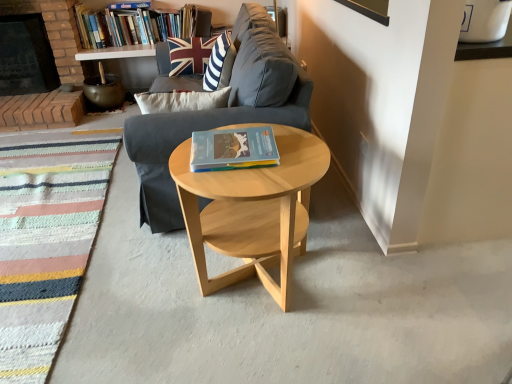
Where is `vacant area that is in front of natural wood side table at center`? vacant area that is in front of natural wood side table at center is located at coordinates (265, 355).